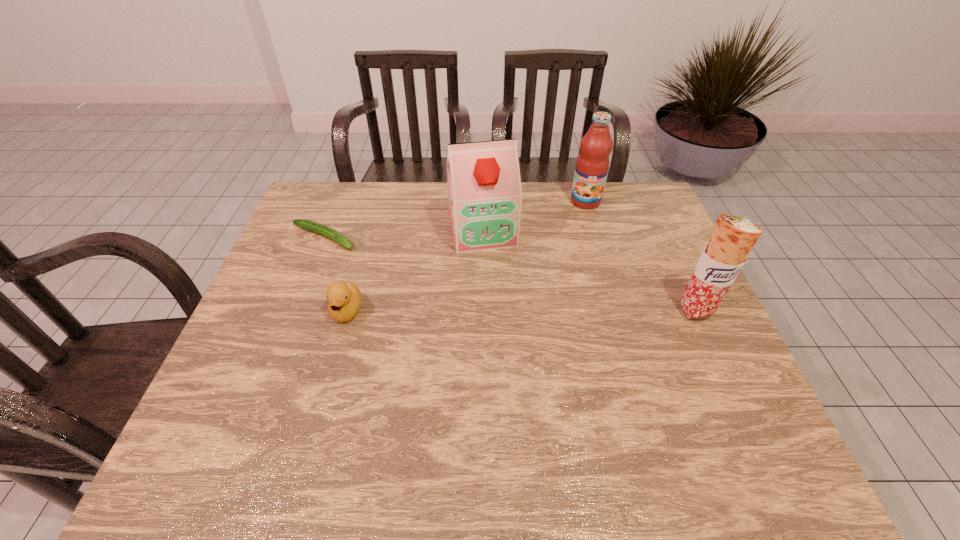
The height and width of the screenshot is (540, 960). Identify the location of vacant spot on the desktop that is between the second shortest object and the burrito and is positioned with the cap open on the soya milk. (504, 310).

What are the coordinates of `free space on the desktop that is between the duckling and the rightmost object and is positioned on the front-facing side of the shortest object` in the screenshot? It's located at (482, 310).

Locate an element on the screen. free space on the desktop that is between the second shortest object and the rightmost object and is positioned on the front label of the fruit juice is located at coordinates (573, 310).